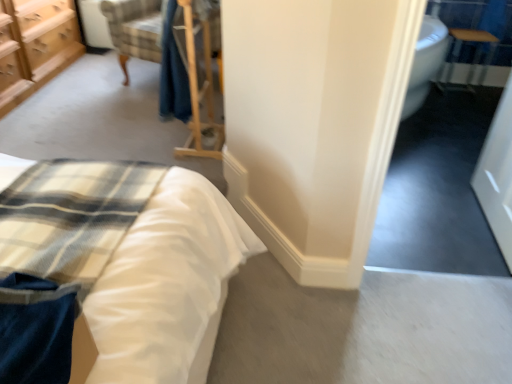
Question: From a real-world perspective, is white glossy door at right on top of wooden chest of drawers at upper left?

Choices:
 (A) no
 (B) yes

Answer: (A)

Question: Is white glossy door at right oriented away from wooden chest of drawers at upper left?

Choices:
 (A) yes
 (B) no

Answer: (B)

Question: From the image's perspective, is white glossy door at right beneath wooden chest of drawers at upper left?

Choices:
 (A) yes
 (B) no

Answer: (A)

Question: Is white glossy door at right not near wooden chest of drawers at upper left?

Choices:
 (A) yes
 (B) no

Answer: (A)

Question: From the image's perspective, does white glossy door at right appear higher than wooden chest of drawers at upper left?

Choices:
 (A) no
 (B) yes

Answer: (A)

Question: In the image, is white glossy door at right positioned in front of or behind wooden chest of drawers at upper left?

Choices:
 (A) behind
 (B) front

Answer: (B)

Question: Based on their positions, is white glossy door at right located to the left or right of wooden chest of drawers at upper left?

Choices:
 (A) right
 (B) left

Answer: (A)

Question: In terms of size, does white glossy door at right appear bigger or smaller than wooden chest of drawers at upper left?

Choices:
 (A) big
 (B) small

Answer: (B)

Question: Considering the positions of white glossy door at right and wooden chest of drawers at upper left in the image, is white glossy door at right wider or thinner than wooden chest of drawers at upper left?

Choices:
 (A) thin
 (B) wide

Answer: (A)

Question: Is point (9, 76) closer or farther from the camera than point (505, 185)?

Choices:
 (A) farther
 (B) closer

Answer: (A)

Question: Is wooden chest of drawers at upper left spatially inside white glossy door at right, or outside of it?

Choices:
 (A) outside
 (B) inside

Answer: (A)

Question: From their relative heights in the image, would you say wooden chest of drawers at upper left is taller or shorter than white glossy door at right?

Choices:
 (A) tall
 (B) short

Answer: (B)

Question: Based on their positions, is wooden chest of drawers at upper left located to the left or right of white glossy door at right?

Choices:
 (A) right
 (B) left

Answer: (B)

Question: Choose the correct answer: Is satin white bed at lower left inside white glossy door at right or outside it?

Choices:
 (A) outside
 (B) inside

Answer: (A)

Question: In terms of height, does satin white bed at lower left look taller or shorter compared to white glossy door at right?

Choices:
 (A) short
 (B) tall

Answer: (A)